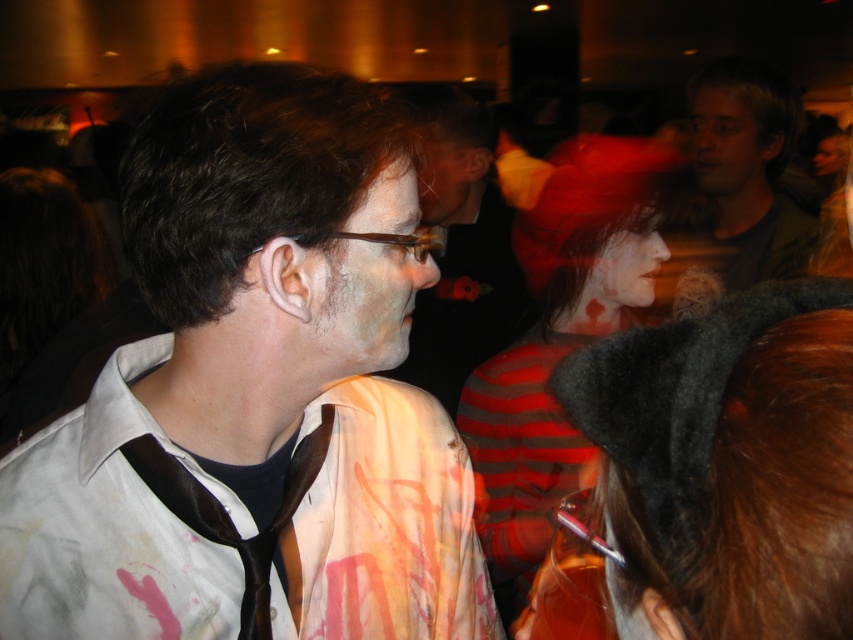
Find the location of a particular element. striped wool sweater at center is located at coordinates (560, 339).

Is striped wool sweater at center further to the viewer compared to black satin tie at center?

Yes, it is behind black satin tie at center.

Does point (515, 579) come in front of point (190, 509)?

No, (515, 579) is further to viewer.

The width and height of the screenshot is (853, 640). In order to click on striped wool sweater at center in this screenshot , I will do `click(560, 339)`.

Is dark gray felt cat ears at lower right thinner than matte black shirt at center?

Correct, dark gray felt cat ears at lower right's width is less than matte black shirt at center's.

Between dark gray felt cat ears at lower right and matte black shirt at center, which one appears on the right side from the viewer's perspective?

Positioned to the right is dark gray felt cat ears at lower right.

Locate an element on the screen. The width and height of the screenshot is (853, 640). dark gray felt cat ears at lower right is located at coordinates (726, 465).

Where is `dark gray felt cat ears at lower right`? The height and width of the screenshot is (640, 853). dark gray felt cat ears at lower right is located at coordinates (726, 465).

Which of these two, striped wool sweater at center or matte black shirt at center, stands shorter?

With less height is striped wool sweater at center.

How far apart are striped wool sweater at center and matte black shirt at center?

striped wool sweater at center and matte black shirt at center are 72.71 centimeters apart from each other.

Does point (564, 332) lie in front of point (426, 305)?

Yes, point (564, 332) is closer to viewer.

Locate an element on the screen. Image resolution: width=853 pixels, height=640 pixels. striped wool sweater at center is located at coordinates (560, 339).